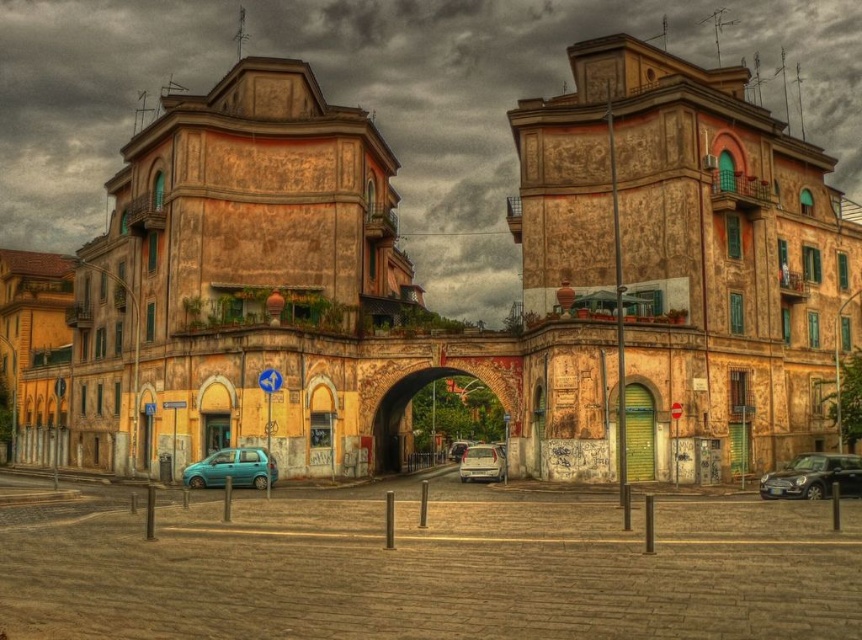
You are standing in the middle of the street looking up at the two points marked on the buildings. Which point, point (620,100) or point (461,444), is closer to your eyes?

Point (620,100) is closer to the camera than point (461,444), so it is closer to your eyes.

You are a delivery driver who needs to pass under the yellow textured building at center with your teal matte hatchback at lower left. Can your vehicle safely pass under the building without hitting the roof?

The yellow textured building at center has a greater height compared to teal matte hatchback at lower left, so the vehicle can safely pass under the building without hitting the roof.

You are driving a matte silver van at center and want to pass under the rustic stone archway at center. Based on the scene, can you safely navigate through without any adjustments?

The rustic stone archway at center is in front of the matte silver van at center, meaning the van is positioned behind the archway. To pass under, you would need to move forward, but since the archway is already in front, it suggests there is enough clearance for the van to pass through safely.